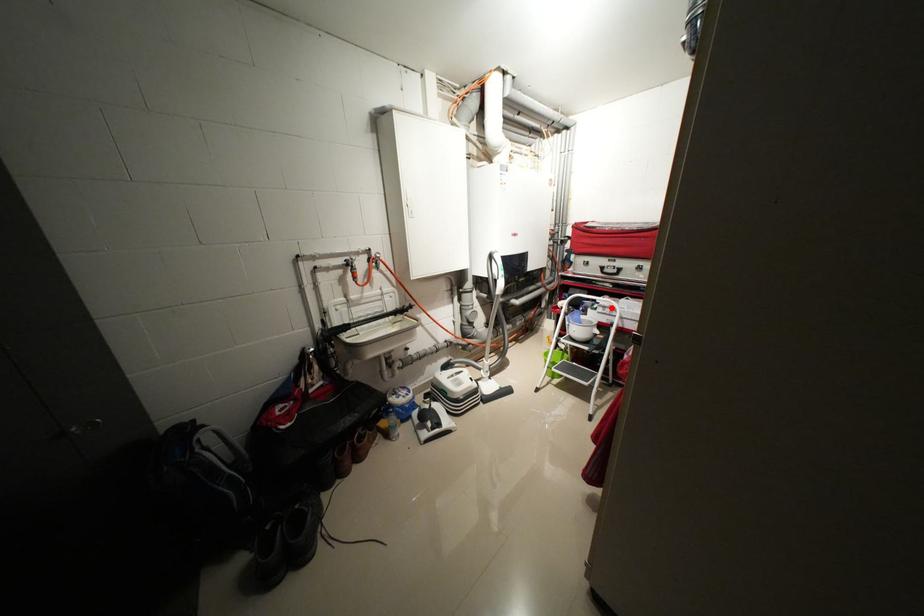
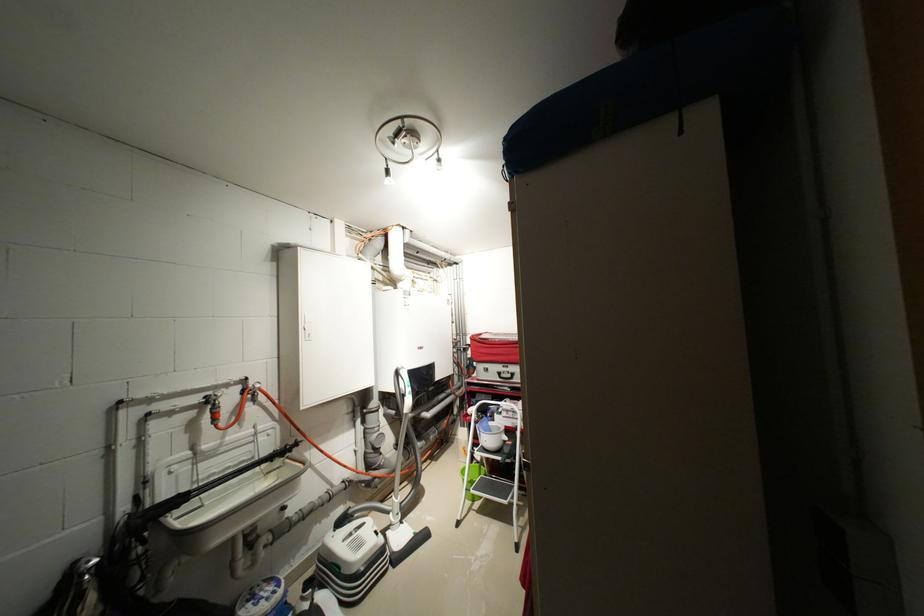
Question: I am providing you with two images of the same scene from different viewpoints. A red point is marked on the first image. Is the red point's position out of view in image 2?

Choices:
 (A) Yes
 (B) No

Answer: (B)